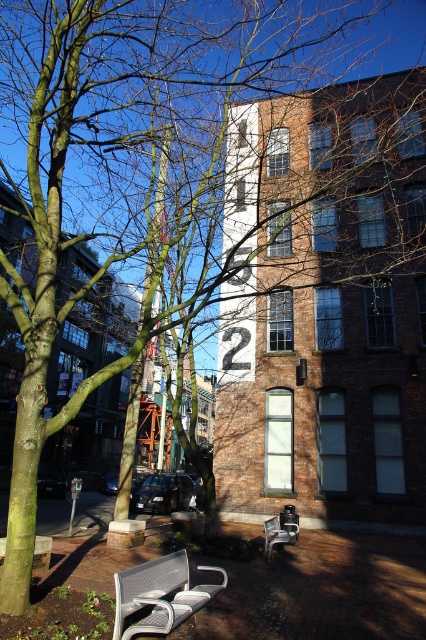
You are planning to sit on one of the benches in the plaza. The metallic mesh bench at lower center and the metallic silver bench at center are both available. Which bench would you choose if you prefer a larger seating area?

The metallic silver bench at center is larger in size compared to the metallic mesh bench at lower center, so you should choose the metallic silver bench at center for a larger seating area.

You are standing in the plaza in front of the large brick building. You notice two points marked on the ground at coordinates point (158, 616) and point (37, 568). Which point is closer to you?

Point (158, 616) is closer to the camera than point (37, 568), so the point closer to you is point (158, 616).

You are a visitor in this urban plaza and want to sit on the benches. If you walk straight ahead from your current position, which bench will you encounter first, the metallic mesh bench at lower center or the metallic silver bench at lower left?

The metallic mesh bench at lower center is closer to the viewer than the metallic silver bench at lower left, so you will encounter the metallic mesh bench at lower center first.